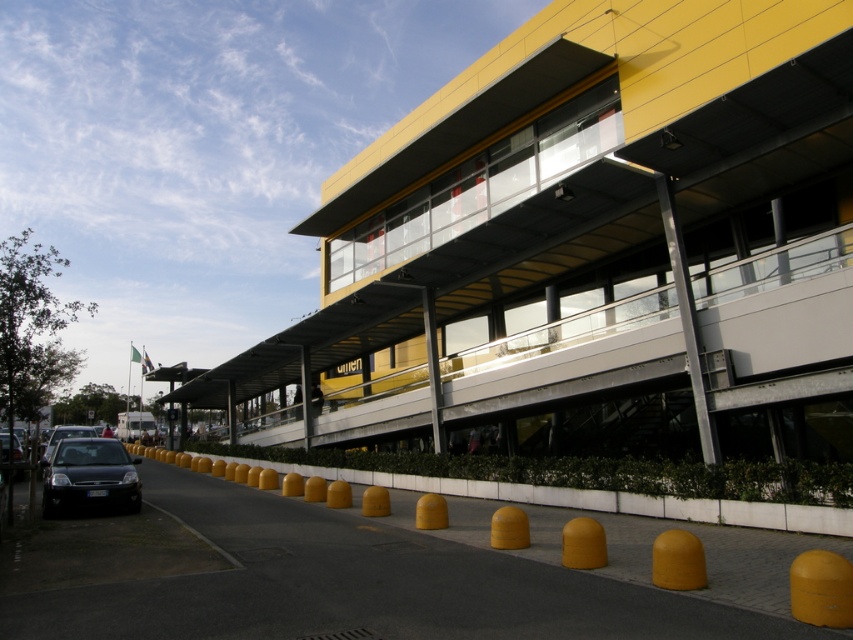
You are a delivery driver who needs to park a 2.5 meter wide truck in the parking area near the yellow matte parking garage at center and the yellow rubber bollard at lower center. Based on the scene, can you confirm if the truck will fit between them without touching either object?

The yellow matte parking garage at center might be wider than the yellow rubber bollard at lower center, but since the exact width isn not provided, it is uncertain whether the truck will fit. Please verify the space before proceeding.

You are a delivery person trying to park your 2.5 meter wide truck. You see the yellow matte parking garage at center and the yellow rubber bollard at lower center. Which parking spot is wider than the truck and closer to the bollard?

The yellow matte parking garage at center is positioned on the left side of yellow rubber bollard at lower center, so the parking garage is closer to the bollard. However, the question does not provide information about the width of the parking spots, so it cannot be determined which is wider than the truck.